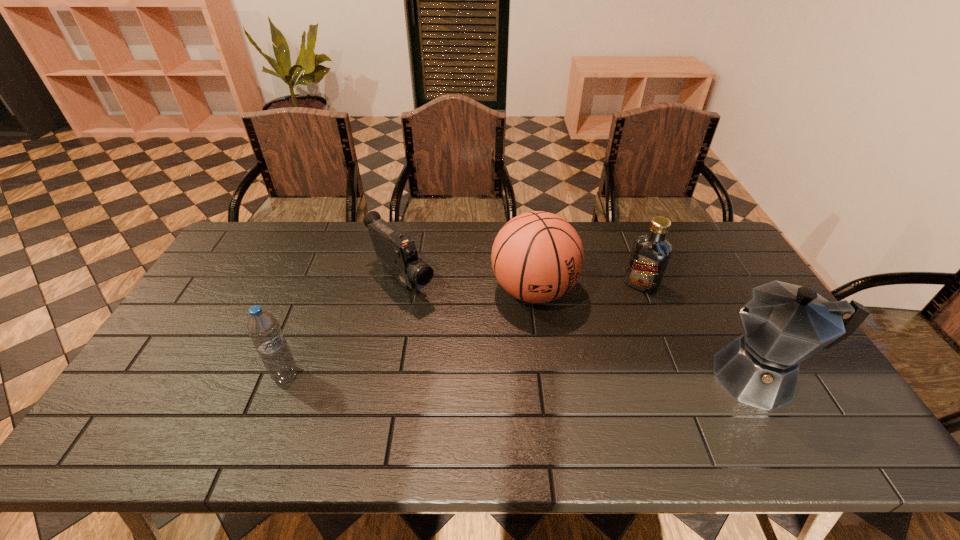
Identify the location of object that is the closest to the leftmost object. (397, 253).

Select which object appears as the fourth closest to the coffeepot. Please provide its 2D coordinates. Your answer should be formatted as a tuple, i.e. [(x, y)], where the tuple contains the x and y coordinates of a point satisfying the conditions above.

[(263, 328)]

Locate an element on the screen. The height and width of the screenshot is (540, 960). vacant space that satisfies the following two spatial constraints: 1. on the back side of the vodka; 2. on the left side of the leftmost object is located at coordinates (x=322, y=285).

Locate an element on the screen. vacant space that satisfies the following two spatial constraints: 1. on the front side of the coffeepot; 2. at the spout of the basketball is located at coordinates click(x=544, y=377).

Identify the location of free space that satisfies the following two spatial constraints: 1. on the back side of the shortest object; 2. on the right side of the leftmost object. This screenshot has width=960, height=540. (323, 280).

You are a GUI agent. You are given a task and a screenshot of the screen. Output one action in this format:
    pyautogui.click(x=<x>, y=<y>)
    Task: Click on the free location that satisfies the following two spatial constraints: 1. on the front side of the coffeepot; 2. at the spout of the second object from right to left
    
    Given the screenshot: What is the action you would take?
    pyautogui.click(x=678, y=377)

Locate an element on the screen. Image resolution: width=960 pixels, height=540 pixels. vacant area that satisfies the following two spatial constraints: 1. on the front side of the rightmost object; 2. at the spout of the water bottle is located at coordinates (285, 377).

Locate an element on the screen. This screenshot has height=540, width=960. free region that satisfies the following two spatial constraints: 1. on the back side of the water bottle; 2. on the right side of the basketball is located at coordinates (319, 291).